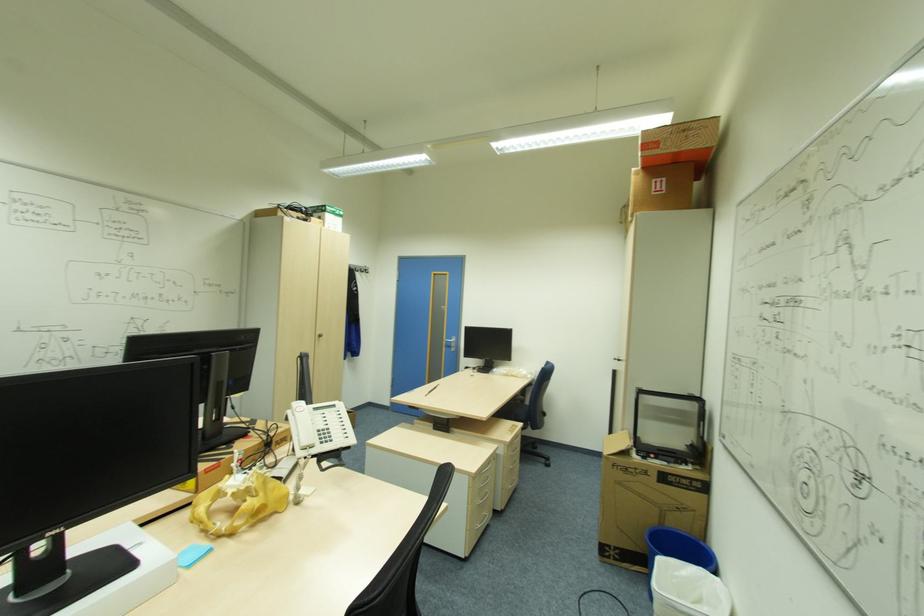
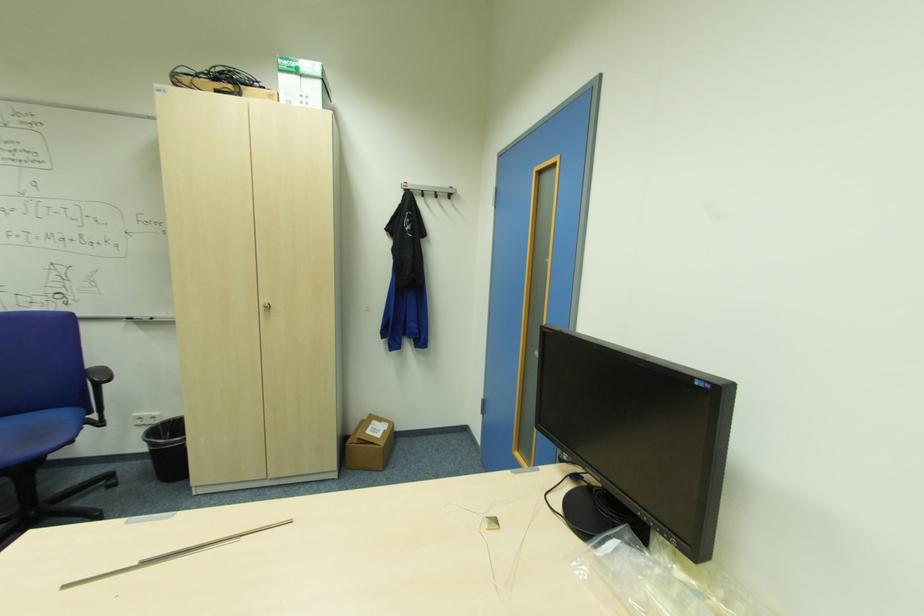
Find the pixel in the second image that matches [322,334] in the first image.

(271, 307)